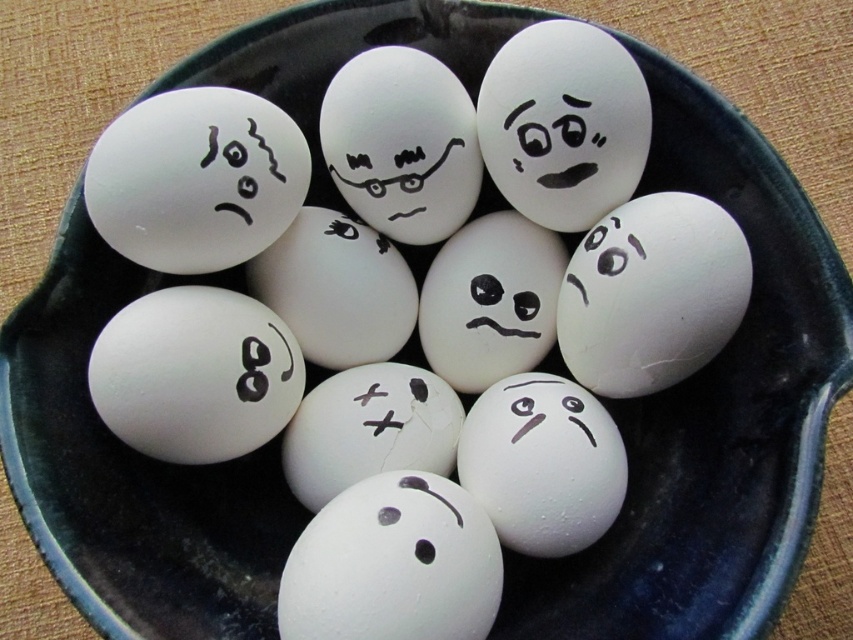
From the picture: Does white matte egg at upper center have a lesser height compared to white matte egg at center?

In fact, white matte egg at upper center may be taller than white matte egg at center.

Is white matte egg at upper center to the left of white matte egg at center from the viewer's perspective?

Incorrect, white matte egg at upper center is not on the left side of white matte egg at center.

Where is `white matte egg at upper center`? white matte egg at upper center is located at coordinates (563, 124).

What are the coordinates of `white matte egg at upper center` in the screenshot? It's located at (563, 124).